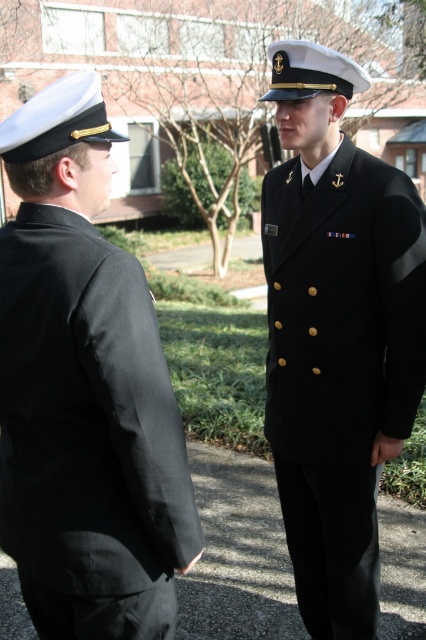
Which of these two, black smooth uniform at left or black woolen jacket at center, stands taller?

black woolen jacket at center

What do you see at coordinates (86, 428) in the screenshot? This screenshot has height=640, width=426. I see `black smooth uniform at left` at bounding box center [86, 428].

Which is behind, point (101, 449) or point (379, 403)?

Positioned behind is point (379, 403).

The image size is (426, 640). Find the location of `black smooth uniform at left`. black smooth uniform at left is located at coordinates (86, 428).